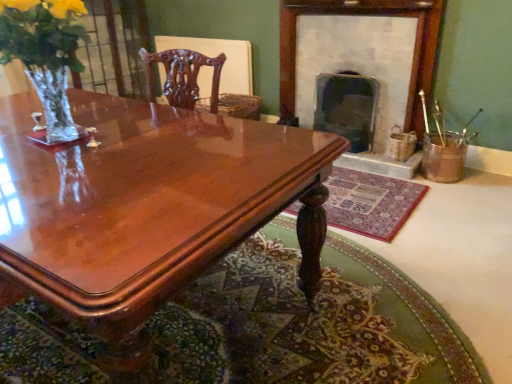
Question: Considering the relative sizes of clear glass vase at left and dark gray stone fireplace at center, acting as the 2th fireplace starting from the left, in the image provided, is clear glass vase at left shorter than dark gray stone fireplace at center, acting as the 2th fireplace starting from the left,?

Choices:
 (A) yes
 (B) no

Answer: (A)

Question: From the image's perspective, does clear glass vase at left appear higher than dark gray stone fireplace at center, acting as the 2th fireplace starting from the left?

Choices:
 (A) yes
 (B) no

Answer: (B)

Question: Is clear glass vase at left looking in the opposite direction of dark gray stone fireplace at center, acting as the 2th fireplace starting from the left?

Choices:
 (A) no
 (B) yes

Answer: (B)

Question: Can you confirm if clear glass vase at left is thinner than dark gray stone fireplace at center, acting as the 2th fireplace starting from the left?

Choices:
 (A) yes
 (B) no

Answer: (A)

Question: Could you tell me if clear glass vase at left is turned towards dark gray stone fireplace at center, arranged as the first fireplace when viewed from the right?

Choices:
 (A) no
 (B) yes

Answer: (A)

Question: Do you think shiny brown wood coffee table at center is within smooth stone fireplace at upper right, which ranks as the 1th fireplace in left-to-right order, or outside of it?

Choices:
 (A) outside
 (B) inside

Answer: (A)

Question: From the image's perspective, is shiny brown wood coffee table at center above or below smooth stone fireplace at upper right, which ranks as the 2th fireplace in right-to-left order?

Choices:
 (A) above
 (B) below

Answer: (B)

Question: From their relative heights in the image, would you say shiny brown wood coffee table at center is taller or shorter than smooth stone fireplace at upper right, which ranks as the 2th fireplace in right-to-left order?

Choices:
 (A) short
 (B) tall

Answer: (A)

Question: Considering the relative positions of shiny brown wood coffee table at center and smooth stone fireplace at upper right, which ranks as the 2th fireplace in right-to-left order, in the image provided, is shiny brown wood coffee table at center to the left or to the right of smooth stone fireplace at upper right, which ranks as the 2th fireplace in right-to-left order,?

Choices:
 (A) left
 (B) right

Answer: (A)

Question: Does point (199, 375) appear closer or farther from the camera than point (362, 100)?

Choices:
 (A) farther
 (B) closer

Answer: (B)

Question: From their relative heights in the image, would you say carpeted rug at center, positioned as the second mat in top-to-bottom order, is taller or shorter than dark gray stone fireplace at center, acting as the 2th fireplace starting from the left?

Choices:
 (A) tall
 (B) short

Answer: (B)

Question: Is carpeted rug at center, marked as the first mat in a bottom-to-top arrangement, bigger or smaller than dark gray stone fireplace at center, acting as the 2th fireplace starting from the left?

Choices:
 (A) small
 (B) big

Answer: (B)

Question: In terms of width, does carpeted rug at center, positioned as the second mat in top-to-bottom order, look wider or thinner when compared to dark gray stone fireplace at center, arranged as the first fireplace when viewed from the right?

Choices:
 (A) wide
 (B) thin

Answer: (A)

Question: From a real-world perspective, is shiny brown wood coffee table at center above or below carpeted mat at lower center, the 1th mat from the top?

Choices:
 (A) above
 (B) below

Answer: (A)

Question: Is point (310, 284) closer or farther from the camera than point (368, 228)?

Choices:
 (A) closer
 (B) farther

Answer: (A)